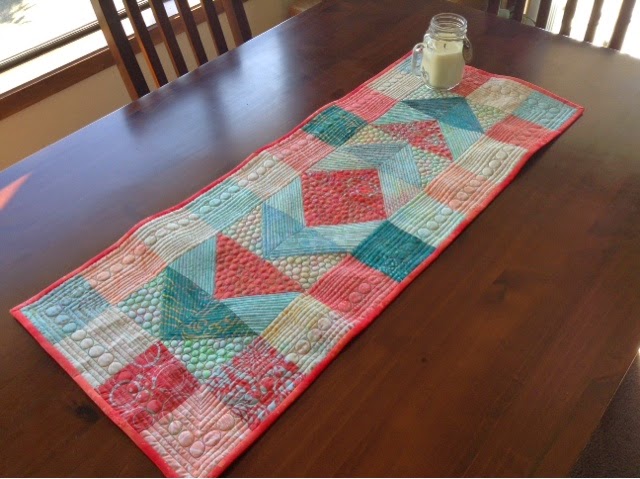
The width and height of the screenshot is (640, 479). In order to click on jar in this screenshot , I will do `click(448, 56)`.